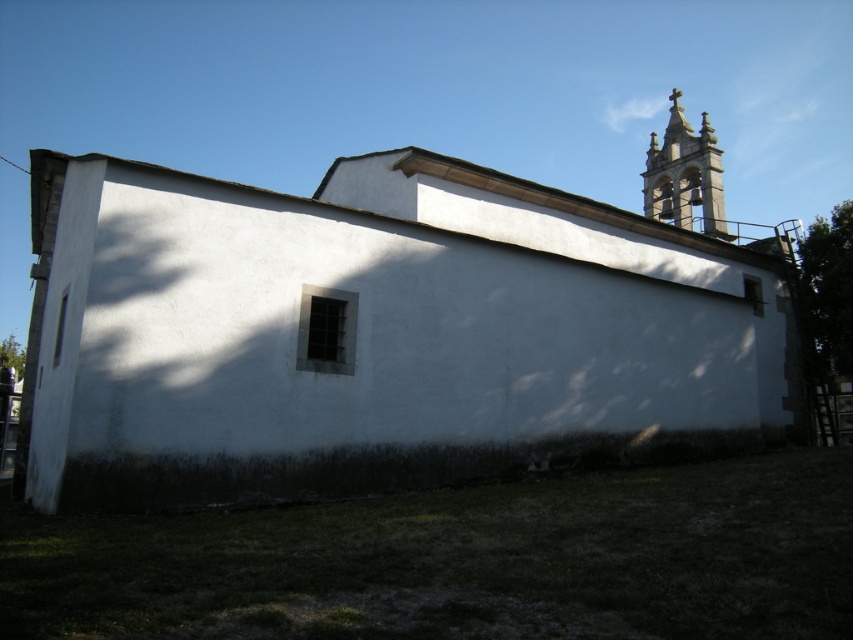
You are an architect assessing the structural integrity of the white matte church at center and the smooth stone bell tower at upper right. Based on their widths, which one requires more reinforcement to withstand strong winds?

The white matte church at center might be wider than smooth stone bell tower at upper right, so it requires more reinforcement to withstand strong winds because wider structures are generally more susceptible to wind forces.

You are standing in front of the white matte church at center and looking towards the smooth stone bell tower at upper right. Which structure is positioned closer to you?

The white matte church at center is closer to you than the smooth stone bell tower at upper right.

You are standing in front of the white matte church at center and looking towards the smooth stone bell tower at upper right. Which structure appears taller from your perspective?

The smooth stone bell tower at upper right is taller than the white matte church at center, so it appears taller from your perspective.